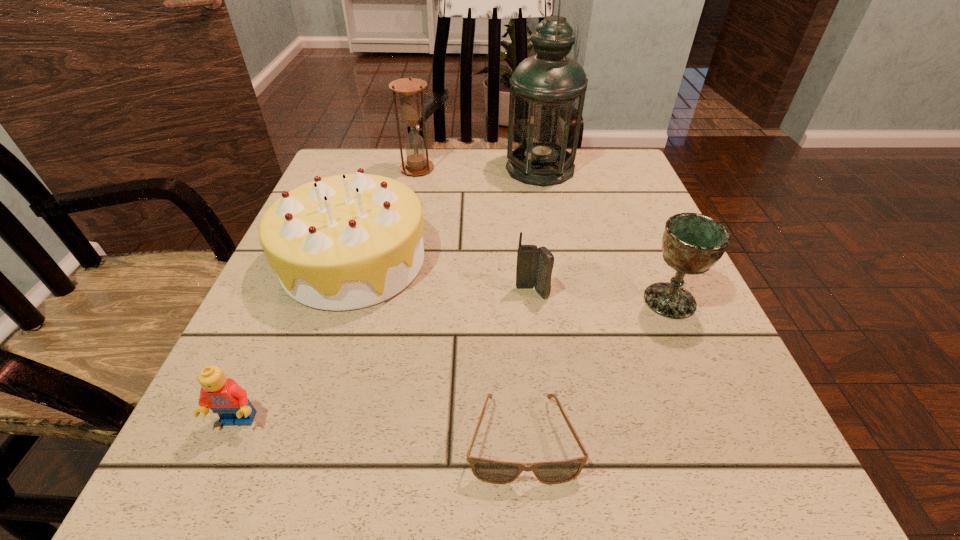
In order to click on free point between the shortest object and the cellular telephone in this screenshot , I will do `click(527, 366)`.

What are the coordinates of `empty location between the rightmost object and the Lego` in the screenshot? It's located at (454, 361).

At what (x,y) coordinates should I click in order to perform the action: click on vacant area that lies between the sunglasses and the tallest object. Please return your answer as a coordinate pair (x, y). Looking at the image, I should click on (532, 303).

Identify the location of free space between the birthday cake and the sunglasses. (439, 349).

Choose which object is the third nearest neighbor to the second tallest object. Please provide its 2D coordinates. Your answer should be formatted as a tuple, i.e. [(x, y)], where the tuple contains the x and y coordinates of a point satisfying the conditions above.

[(534, 267)]

Image resolution: width=960 pixels, height=540 pixels. I want to click on the sixth closest object to the oil lamp, so click(223, 396).

Locate an element on the screen. This screenshot has height=540, width=960. free location that satisfies the following two spatial constraints: 1. on the keyboard of the rightmost object; 2. on the left side of the cellular telephone is located at coordinates (533, 301).

Find the location of a particular element. vacant space that satisfies the following two spatial constraints: 1. on the back side of the sixth shortest object; 2. on the left side of the birthday cake is located at coordinates (383, 169).